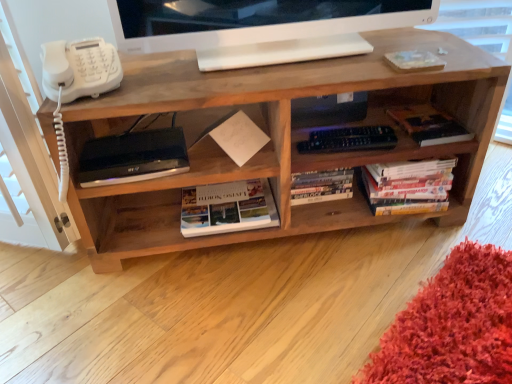
Question: Which direction should I rotate to look at white glossy book at center, which appears as the 3th book when viewed from the right, — up or down?

Choices:
 (A) up
 (B) down

Answer: (B)

Question: Would you say hardcover book at center-right, which is counted as the 3th book, starting from the left, contains satin black device at lower left?

Choices:
 (A) no
 (B) yes

Answer: (A)

Question: From a real-world perspective, does hardcover book at center-right, which is counted as the 3th book, starting from the left, stand above satin black device at lower left?

Choices:
 (A) no
 (B) yes

Answer: (A)

Question: Is hardcover book at center-right, the first book in the right-to-left sequence, shorter than satin black device at lower left?

Choices:
 (A) yes
 (B) no

Answer: (A)

Question: Can you confirm if hardcover book at center-right, which is counted as the 3th book, starting from the left, is positioned to the left of satin black device at lower left?

Choices:
 (A) no
 (B) yes

Answer: (A)

Question: Is hardcover book at center-right, which is counted as the 3th book, starting from the left, taller than satin black device at lower left?

Choices:
 (A) no
 (B) yes

Answer: (A)

Question: Considering the relative positions of hardcover book at center-right, which is counted as the 3th book, starting from the left, and satin black device at lower left in the image provided, is hardcover book at center-right, which is counted as the 3th book, starting from the left, to the right of satin black device at lower left from the viewer's perspective?

Choices:
 (A) yes
 (B) no

Answer: (A)

Question: Is the position of white glossy monitor at upper center less distant than that of natural wood shelf at center?

Choices:
 (A) no
 (B) yes

Answer: (A)

Question: Is white glossy monitor at upper center to the left of natural wood shelf at center from the viewer's perspective?

Choices:
 (A) yes
 (B) no

Answer: (B)

Question: Can you confirm if white glossy monitor at upper center is shorter than natural wood shelf at center?

Choices:
 (A) yes
 (B) no

Answer: (A)

Question: From the image's perspective, is white glossy monitor at upper center on natural wood shelf at center?

Choices:
 (A) no
 (B) yes

Answer: (B)

Question: Is white glossy monitor at upper center taller than natural wood shelf at center?

Choices:
 (A) no
 (B) yes

Answer: (A)

Question: Does white glossy monitor at upper center have a larger size compared to natural wood shelf at center?

Choices:
 (A) yes
 (B) no

Answer: (B)

Question: Can you confirm if satin black device at lower left is smaller than white plastic phone at left?

Choices:
 (A) yes
 (B) no

Answer: (A)